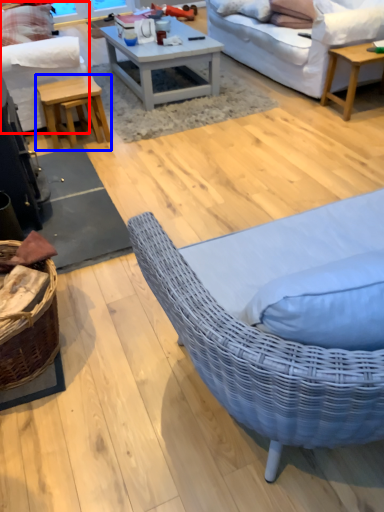
Question: Which point is further to the camera, studio couch (highlighted by a red box) or table (highlighted by a blue box)?

Choices:
 (A) studio couch
 (B) table

Answer: (B)